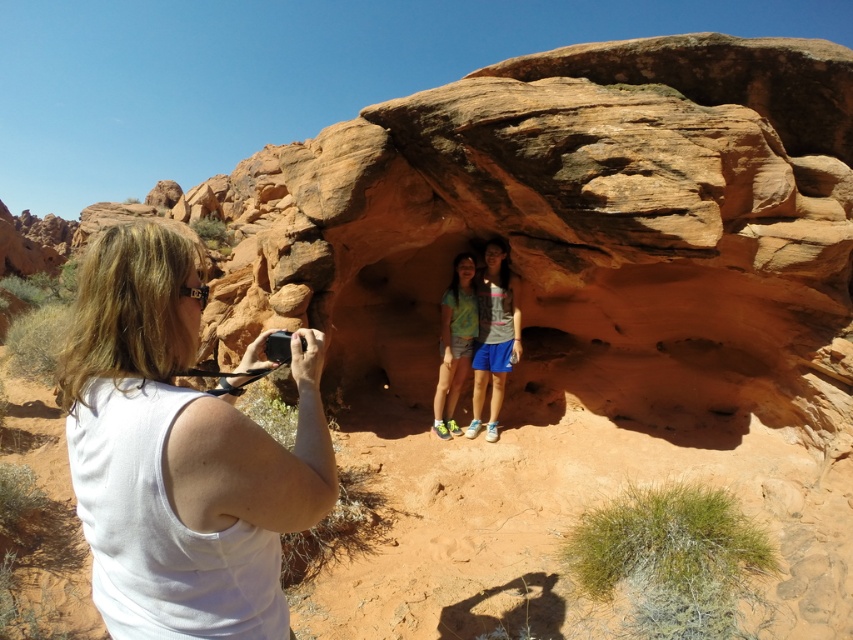
Question: Does white fabric at left appear over green fabric shirt at center?

Choices:
 (A) yes
 (B) no

Answer: (B)

Question: Does white fabric at left appear on the left side of green fabric shirt at center?

Choices:
 (A) no
 (B) yes

Answer: (B)

Question: Among these objects, which one is farthest from the camera?

Choices:
 (A) white fabric at left
 (B) green fabric shirt at center

Answer: (B)

Question: Which object is farther from the camera taking this photo?

Choices:
 (A) white fabric at left
 (B) green fabric shirt at center

Answer: (B)

Question: Which object appears farthest from the camera in this image?

Choices:
 (A) green fabric shirt at center
 (B) white fabric at left

Answer: (A)

Question: Does white fabric at left appear under green fabric shirt at center?

Choices:
 (A) yes
 (B) no

Answer: (A)